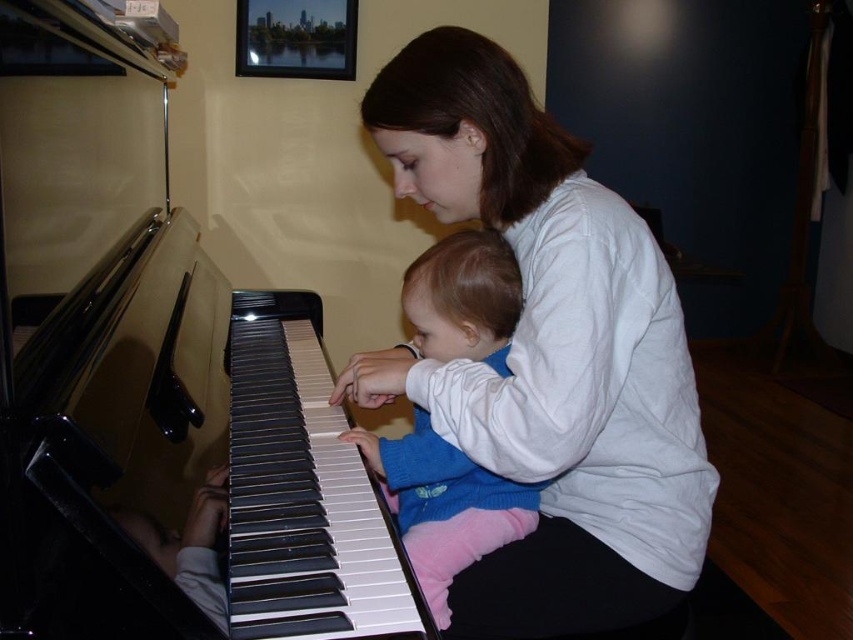
Question: Does white matte shirt at center have a lesser width compared to blue fleece sweater at center?

Choices:
 (A) no
 (B) yes

Answer: (A)

Question: Which point is farther from the camera taking this photo?

Choices:
 (A) (450, 476)
 (B) (177, 314)

Answer: (B)

Question: Observing the image, what is the correct spatial positioning of black polished piano at left in reference to blue fleece sweater at center?

Choices:
 (A) right
 (B) left

Answer: (B)

Question: Which object is the closest to the blue fleece sweater at center?

Choices:
 (A) white matte shirt at center
 (B) black polished piano at left

Answer: (A)

Question: Which point is farther to the camera?

Choices:
 (A) (415, 413)
 (B) (91, 296)

Answer: (A)

Question: In this image, where is white matte shirt at center located relative to blue fleece sweater at center?

Choices:
 (A) above
 (B) below

Answer: (A)